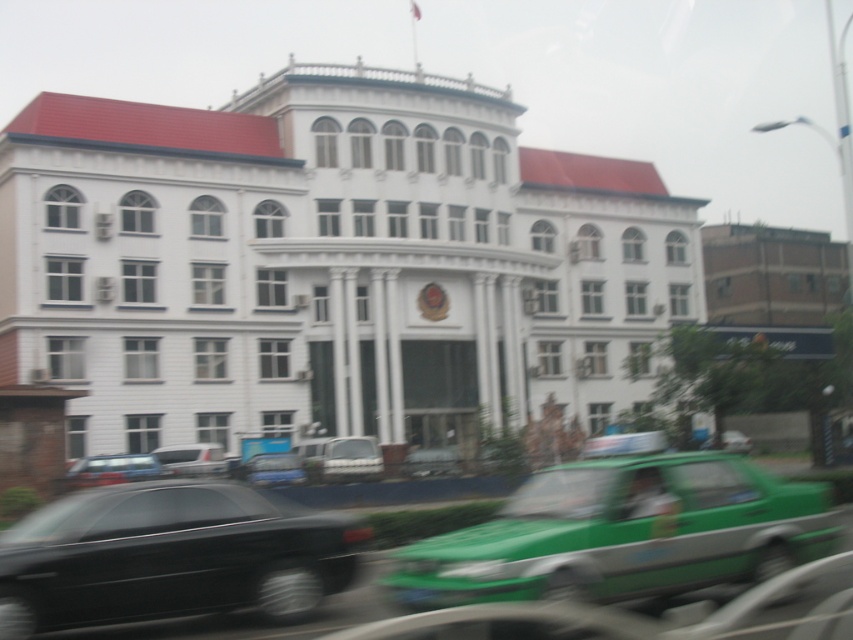
Can you confirm if matte silver sedan at lower left is positioned below green matte car at center?

No.

Does point (137, 468) come behind point (459, 470)?

Yes, it is behind point (459, 470).

Who is more distant from viewer, (125, 461) or (409, 448)?

The point (409, 448) is more distant.

Identify the location of matte silver sedan at lower left. (112, 468).

The height and width of the screenshot is (640, 853). Describe the element at coordinates (271, 468) in the screenshot. I see `blue metallic sedan at center` at that location.

Can you confirm if blue metallic sedan at center is positioned to the right of green matte car at center?

No, blue metallic sedan at center is not to the right of green matte car at center.

Is point (253, 464) positioned before point (404, 467)?

That is True.

The image size is (853, 640). Find the location of `blue metallic sedan at center`. blue metallic sedan at center is located at coordinates (271, 468).

Measure the distance between green matte taxi at lower right and matte silver sedan at lower left.

green matte taxi at lower right and matte silver sedan at lower left are 24.41 meters apart from each other.

Which of these two, green matte taxi at lower right or matte silver sedan at lower left, stands shorter?

With less height is green matte taxi at lower right.

Is point (798, 532) farther from camera compared to point (132, 456)?

No, it is in front of (132, 456).

Locate an element on the screen. green matte taxi at lower right is located at coordinates (624, 532).